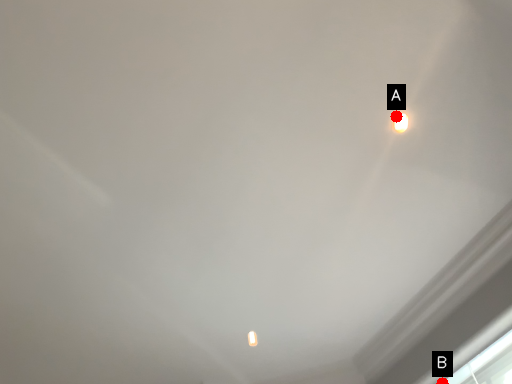
Question: Two points are circled on the image, labeled by A and B beside each circle. Which point is farther to the camera?

Choices:
 (A) A is further
 (B) B is further

Answer: (B)